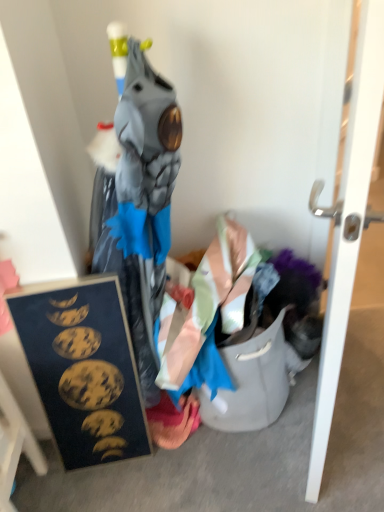
Question: Could you tell me if white glossy door at right is turned towards pink fabric at lower center?

Choices:
 (A) no
 (B) yes

Answer: (A)

Question: From the image's perspective, is white glossy door at right beneath pink fabric at lower center?

Choices:
 (A) yes
 (B) no

Answer: (B)

Question: Does white glossy door at right have a larger size compared to pink fabric at lower center?

Choices:
 (A) yes
 (B) no

Answer: (A)

Question: Is white glossy door at right to the right of pink fabric at lower center from the viewer's perspective?

Choices:
 (A) no
 (B) yes

Answer: (B)

Question: From a real-world perspective, does white glossy door at right stand above pink fabric at lower center?

Choices:
 (A) yes
 (B) no

Answer: (A)

Question: Considering the positions of pink fabric at lower center and white glossy door at right in the image, is pink fabric at lower center taller or shorter than white glossy door at right?

Choices:
 (A) short
 (B) tall

Answer: (A)

Question: Considering their positions, is pink fabric at lower center located in front of or behind white glossy door at right?

Choices:
 (A) front
 (B) behind

Answer: (B)

Question: Is pink fabric at lower center wider or thinner than white glossy door at right?

Choices:
 (A) thin
 (B) wide

Answer: (B)

Question: Visually, is pink fabric at lower center positioned to the left or to the right of white glossy door at right?

Choices:
 (A) right
 (B) left

Answer: (B)

Question: From the image's perspective, is wooden frame at lower left located above or below pink fabric at lower center?

Choices:
 (A) above
 (B) below

Answer: (B)

Question: Considering the positions of wooden frame at lower left and pink fabric at lower center in the image, is wooden frame at lower left bigger or smaller than pink fabric at lower center?

Choices:
 (A) big
 (B) small

Answer: (A)

Question: Considering the positions of point (39, 472) and point (148, 409), is point (39, 472) closer or farther from the camera than point (148, 409)?

Choices:
 (A) farther
 (B) closer

Answer: (B)

Question: Relative to pink fabric at lower center, is wooden frame at lower left in front or behind?

Choices:
 (A) behind
 (B) front

Answer: (B)

Question: In the image, is white glossy door at right on the left side or the right side of pink fabric at lower center?

Choices:
 (A) left
 (B) right

Answer: (B)

Question: From a real-world perspective, is white glossy door at right physically located above or below pink fabric at lower center?

Choices:
 (A) above
 (B) below

Answer: (A)